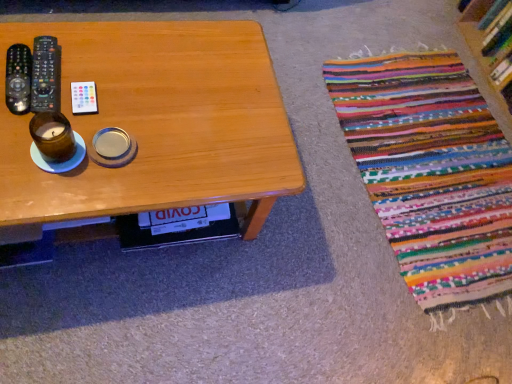
Where is `free space to the left of wooden bookshelf at upper right`? Image resolution: width=512 pixels, height=384 pixels. free space to the left of wooden bookshelf at upper right is located at coordinates (429, 48).